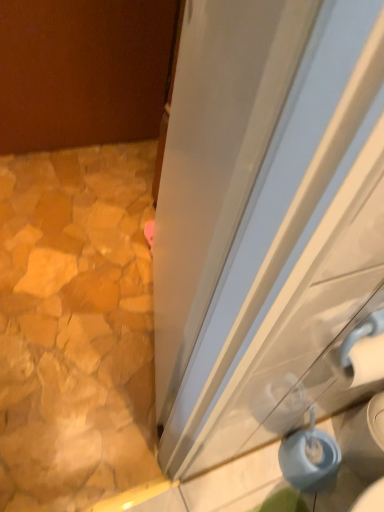
Find the location of a particular element. white glossy screen door at center is located at coordinates (263, 214).

The height and width of the screenshot is (512, 384). What do you see at coordinates (263, 214) in the screenshot?
I see `white glossy screen door at center` at bounding box center [263, 214].

The image size is (384, 512). In order to click on white glossy screen door at center in this screenshot , I will do `click(263, 214)`.